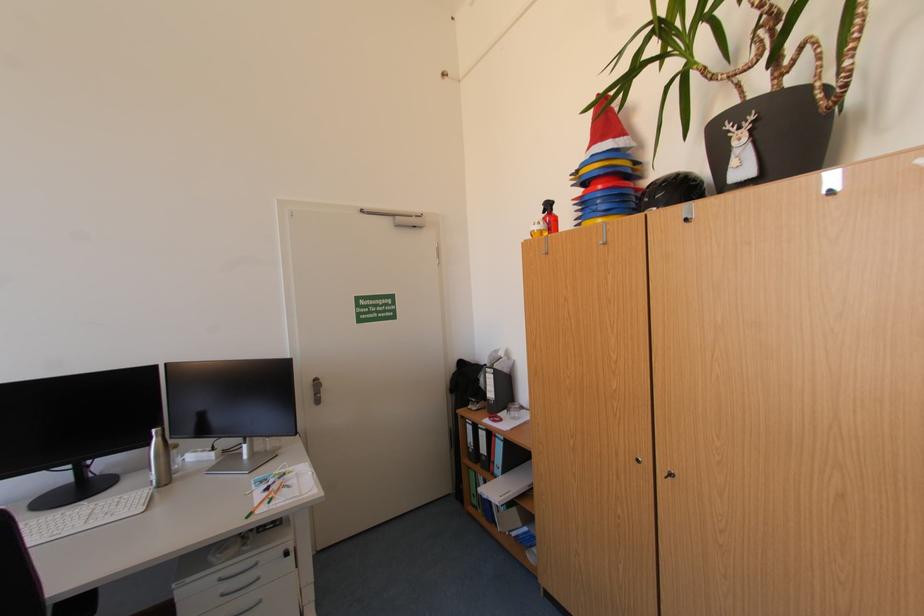
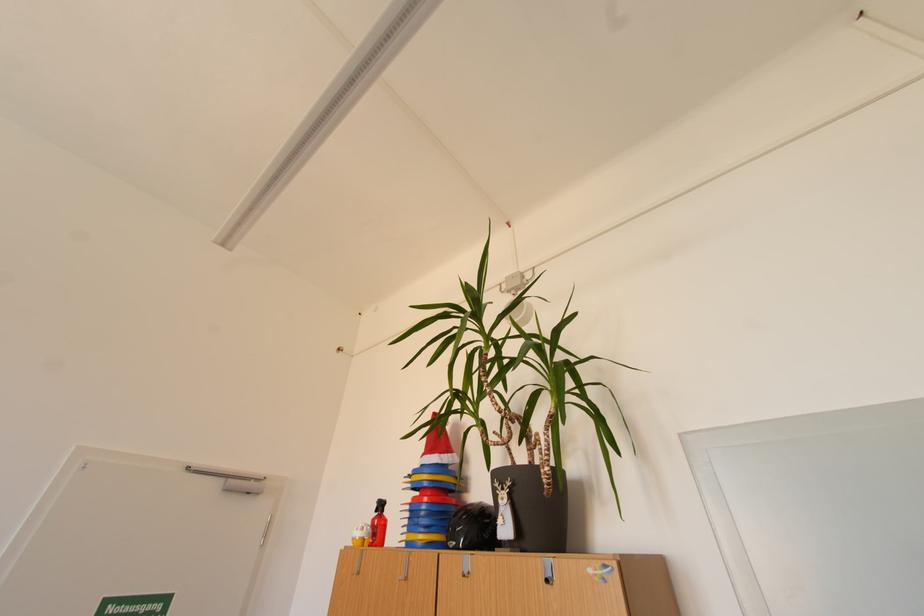
Find the pixel in the second image that matches (x=551, y=227) in the first image.

(373, 533)